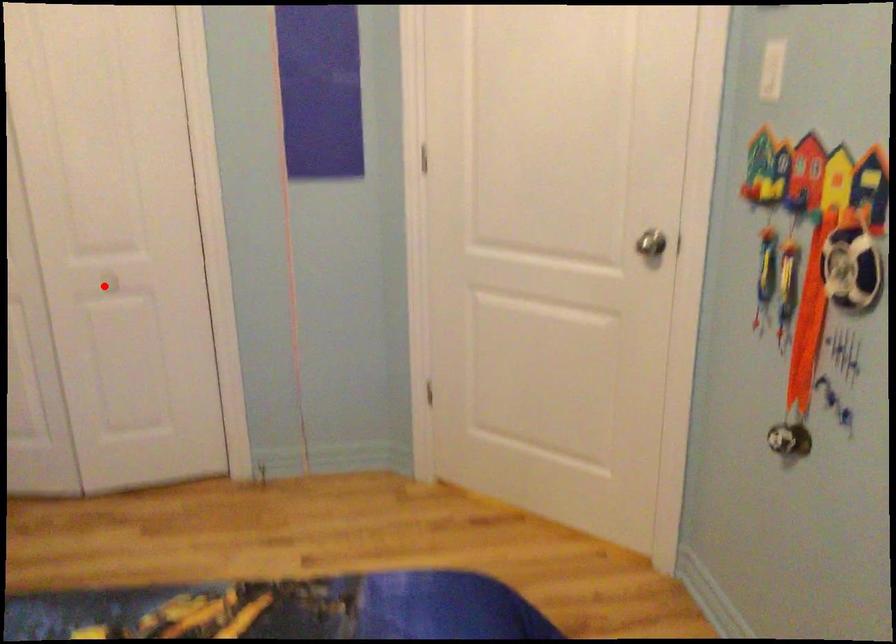
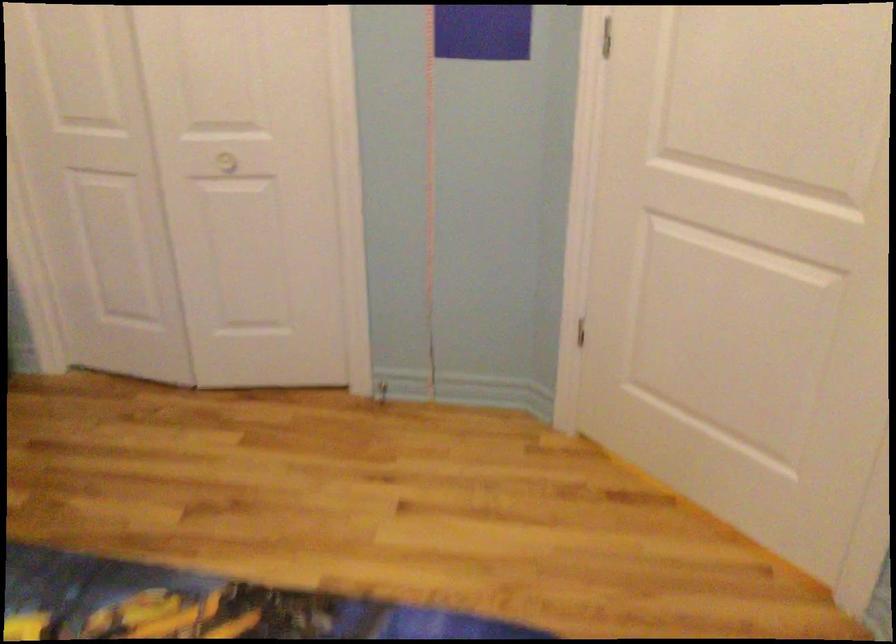
Question: A red point is marked in image1. In image2, is the corresponding 3D point closer to the camera or farther? Reply with the corresponding letter.

Choices:
 (A) The corresponding 3D point is closer.
 (B) The corresponding 3D point is farther.

Answer: (A)